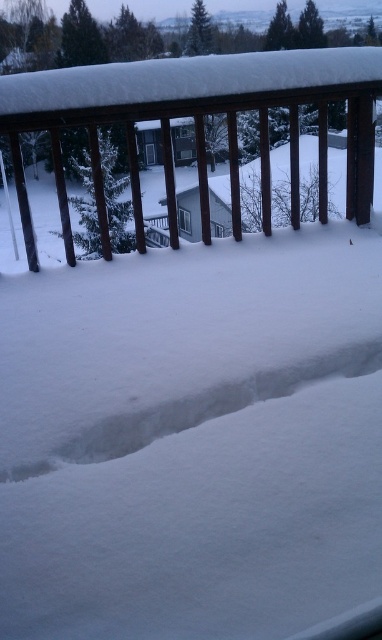
Does point (323, 173) lie behind point (359, 353)?

Yes, point (323, 173) is farther from viewer.

The height and width of the screenshot is (640, 382). Describe the element at coordinates (195, 136) in the screenshot. I see `wooden railing at upper center` at that location.

Where is `wooden railing at upper center`? The width and height of the screenshot is (382, 640). wooden railing at upper center is located at coordinates (195, 136).